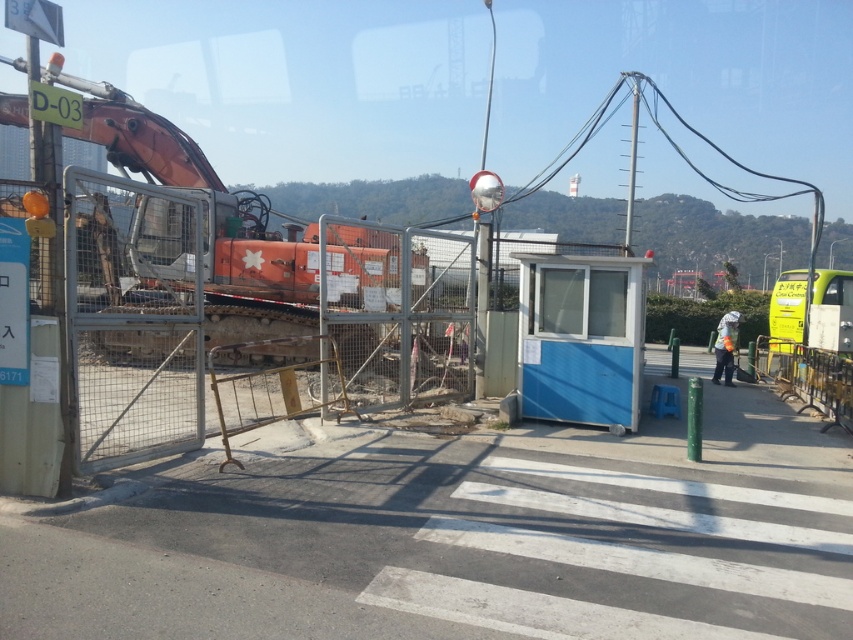
Question: Which is nearer to the blue plastic booth at center?

Choices:
 (A) orange metallic excavator at left
 (B) reflective orange vest at center

Answer: (A)

Question: Does orange metallic excavator at left appear under reflective orange vest at center?

Choices:
 (A) yes
 (B) no

Answer: (B)

Question: Estimate the real-world distances between objects in this image. Which object is closer to the reflective orange vest at center?

Choices:
 (A) blue plastic booth at center
 (B) orange metallic excavator at left

Answer: (A)

Question: Is orange metallic excavator at left smaller than reflective orange vest at center?

Choices:
 (A) no
 (B) yes

Answer: (A)

Question: Among these points, which one is farthest from the camera?

Choices:
 (A) (19, 64)
 (B) (720, 332)

Answer: (B)

Question: Is orange metallic excavator at left above reflective orange vest at center?

Choices:
 (A) yes
 (B) no

Answer: (A)